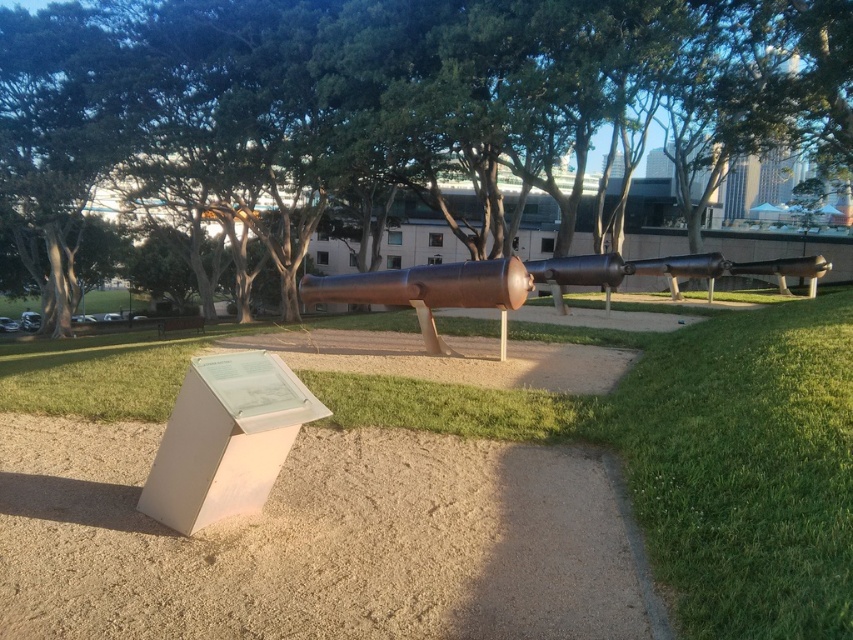
Does point (489, 413) come behind point (329, 284)?

No, (489, 413) is in front of (329, 284).

Between green grass at center and bronze cannon at center, which one is positioned higher?

Positioned higher is bronze cannon at center.

This screenshot has width=853, height=640. Describe the element at coordinates (695, 456) in the screenshot. I see `green grass at center` at that location.

The width and height of the screenshot is (853, 640). In order to click on green grass at center in this screenshot , I will do pyautogui.click(x=695, y=456).

Does bronze cannon at center appear on the right side of green leafy tree at center?

Yes, bronze cannon at center is to the right of green leafy tree at center.

Measure the distance from bronze cannon at center to green leafy tree at center.

bronze cannon at center and green leafy tree at center are 6.41 meters apart.

Is point (563, 259) in front of point (683, 106)?

Yes.

Image resolution: width=853 pixels, height=640 pixels. Find the location of `bronze cannon at center`. bronze cannon at center is located at coordinates (531, 282).

Does green grass at center have a smaller size compared to green leafy tree at center?

Yes, green grass at center is smaller than green leafy tree at center.

How far apart are green grass at center and green leafy tree at center?

The distance of green grass at center from green leafy tree at center is 12.39 meters.

Is point (840, 404) behind point (799, 0)?

No, it is in front of (799, 0).

Image resolution: width=853 pixels, height=640 pixels. I want to click on green grass at center, so coord(695,456).